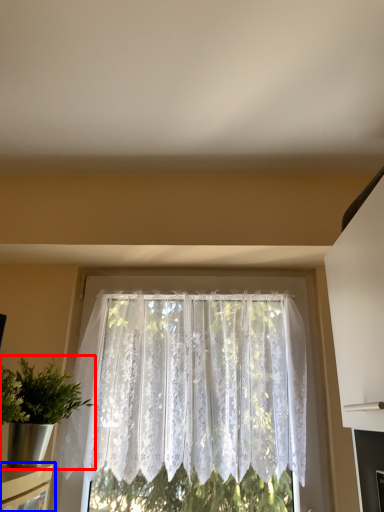
Question: Which object appears closest to the camera in this image, houseplant (highlighted by a red box) or shelf (highlighted by a blue box)?

Choices:
 (A) houseplant
 (B) shelf

Answer: (B)